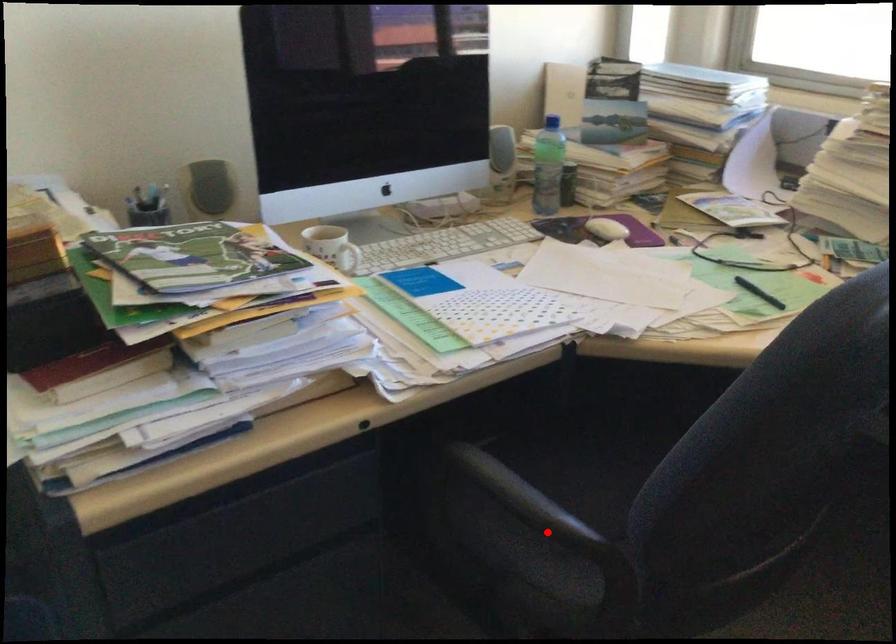
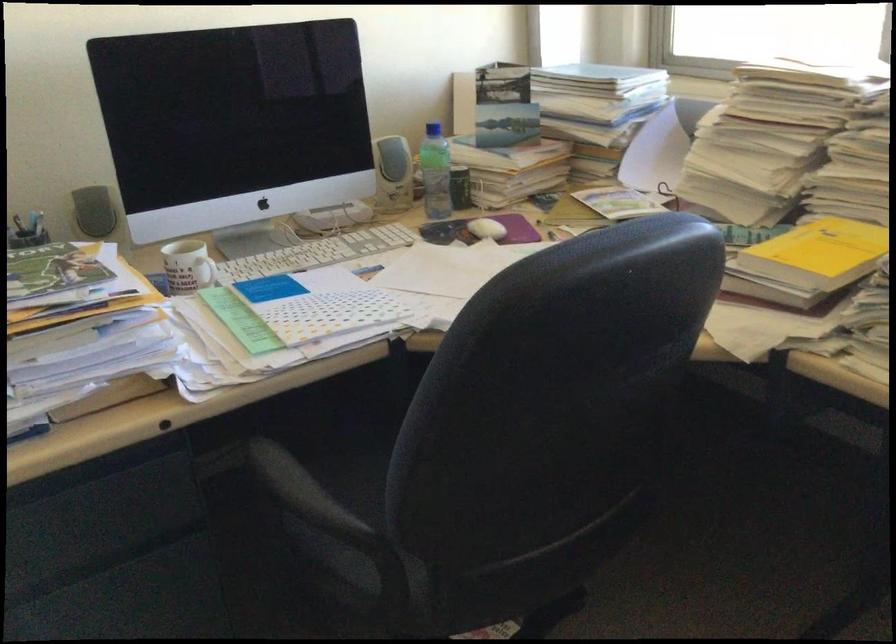
Locate, in the second image, the point that corresponds to the highlighted location in the first image.

(314, 521)